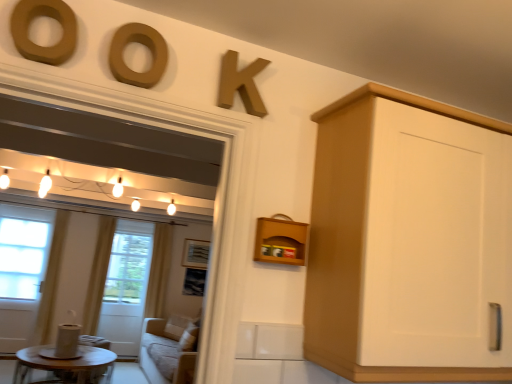
Question: From a real-world perspective, is white glass screen door at left located beneath wooden picture frame at center?

Choices:
 (A) yes
 (B) no

Answer: (A)

Question: Does white glass screen door at left have a larger size compared to wooden picture frame at center?

Choices:
 (A) no
 (B) yes

Answer: (B)

Question: From a real-world perspective, is white glass screen door at left physically above wooden picture frame at center?

Choices:
 (A) yes
 (B) no

Answer: (B)

Question: Is white glass screen door at left positioned with its back to wooden picture frame at center?

Choices:
 (A) yes
 (B) no

Answer: (B)

Question: Is white glass screen door at left closer to the viewer compared to wooden picture frame at center?

Choices:
 (A) yes
 (B) no

Answer: (A)

Question: Which is correct: white glass screen door at left is inside wooden round table at lower left, or outside of it?

Choices:
 (A) inside
 (B) outside

Answer: (B)

Question: In the image, is white glass screen door at left on the left side or the right side of wooden round table at lower left?

Choices:
 (A) right
 (B) left

Answer: (A)

Question: Is white glass screen door at left taller or shorter than wooden round table at lower left?

Choices:
 (A) tall
 (B) short

Answer: (A)

Question: Is point (104, 324) closer or farther from the camera than point (93, 374)?

Choices:
 (A) closer
 (B) farther

Answer: (B)

Question: In the image, is matte wood letter at upper center, the second oval from the left, positioned in front of or behind matte gold letter k at upper center?

Choices:
 (A) behind
 (B) front

Answer: (B)

Question: Is point (120, 69) positioned closer to the camera than point (242, 82)?

Choices:
 (A) closer
 (B) farther

Answer: (A)

Question: From a real-world perspective, is matte wood letter at upper center, positioned as the 1th oval in right-to-left order, physically located above or below matte gold letter k at upper center?

Choices:
 (A) below
 (B) above

Answer: (A)

Question: From the image's perspective, is matte wood letter at upper center, positioned as the 1th oval in right-to-left order, positioned above or below matte gold letter k at upper center?

Choices:
 (A) below
 (B) above

Answer: (B)

Question: From the image's perspective, is white fabric curtain at left, positioned as the first curtain in left-to-right order, above or below white sheer curtain at left, which is the 2th curtain in left-to-right order?

Choices:
 (A) below
 (B) above

Answer: (B)

Question: Choose the correct answer: Is white fabric curtain at left, positioned as the first curtain in left-to-right order, inside white sheer curtain at left, which is the 2th curtain in left-to-right order, or outside it?

Choices:
 (A) inside
 (B) outside

Answer: (B)